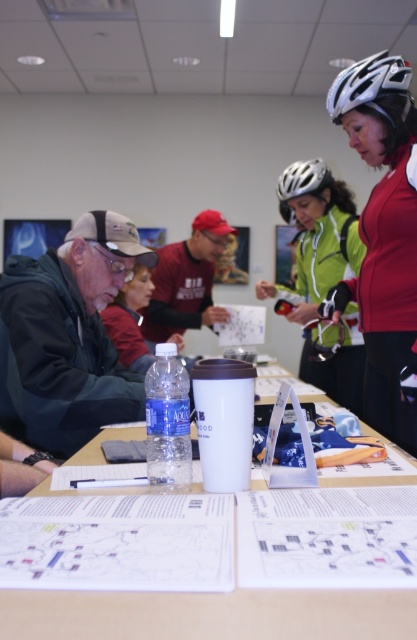
Question: Observing the image, what is the correct spatial positioning of green matte jacket at center in reference to matte black jacket at left?

Choices:
 (A) above
 (B) below

Answer: (A)

Question: Does matte black helmet at upper right appear on the right side of clear plastic bottle at center?

Choices:
 (A) no
 (B) yes

Answer: (B)

Question: Which object is closer to the camera taking this photo?

Choices:
 (A) white paper at center
 (B) matte black helmet at upper right

Answer: (A)

Question: Can you confirm if white matte bicycle helmet at upper right is smaller than silver metallic helmet at upper center?

Choices:
 (A) no
 (B) yes

Answer: (A)

Question: Which of the following is the farthest from the observer?

Choices:
 (A) matte black helmet at upper right
 (B) green matte jacket at center
 (C) clear plastic bottle at center
 (D) white matte bicycle helmet at upper right

Answer: (B)

Question: Which point is farther from the camera taking this photo?

Choices:
 (A) (343, 401)
 (B) (381, 108)

Answer: (A)